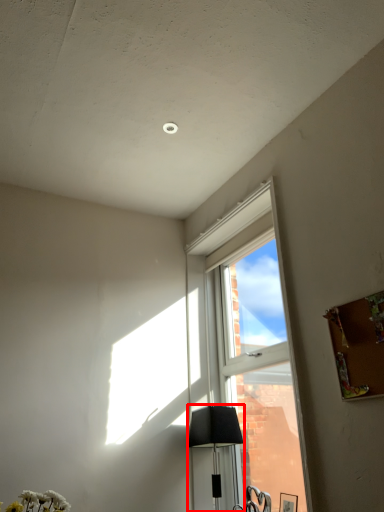
Question: From the image's perspective, considering the relative positions of lamp (annotated by the red box) and window in the image provided, where is lamp (annotated by the red box) located with respect to the staircase?

Choices:
 (A) above
 (B) below

Answer: (B)